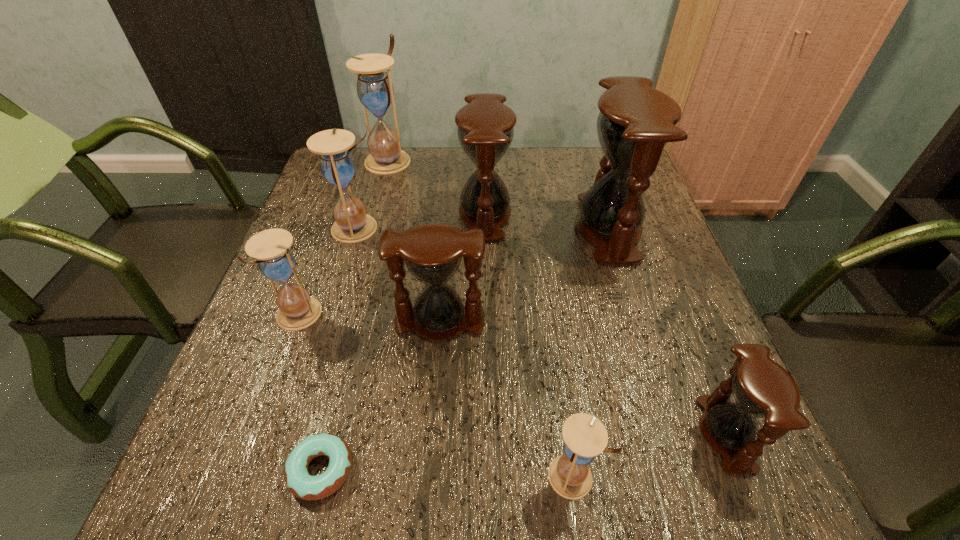
I want to click on the shortest object, so click(x=300, y=483).

I want to click on doughnut, so click(300, 483).

Image resolution: width=960 pixels, height=540 pixels. What are the coordinates of `blank area located on the front of the biggest white hourglass` in the screenshot? It's located at (372, 219).

Identify the location of free space located 0.170m on the left of the biggest brown hourglass. The image size is (960, 540). pos(506,228).

Locate an element on the screen. vacant position located 0.260m on the right of the third smallest brown hourglass is located at coordinates (612, 214).

Identify the location of vacant space located 0.260m on the front of the second farthest white hourglass. (328, 331).

Locate an element on the screen. free point located on the right of the third farthest white hourglass is located at coordinates (448, 316).

What are the coordinates of `vacant space located 0.110m on the front of the third farthest brown hourglass` in the screenshot? It's located at (434, 394).

You are a GUI agent. You are given a task and a screenshot of the screen. Output one action in this format:
    pyautogui.click(x=<x>, y=<y>)
    Task: Click on the vacant space situated on the back of the smallest brown hourglass
    Image resolution: width=960 pixels, height=540 pixels.
    Given the screenshot: What is the action you would take?
    pyautogui.click(x=683, y=328)

Locate an element on the screen. The height and width of the screenshot is (540, 960). free region located on the back of the sixth hourglass from left to right is located at coordinates (549, 309).